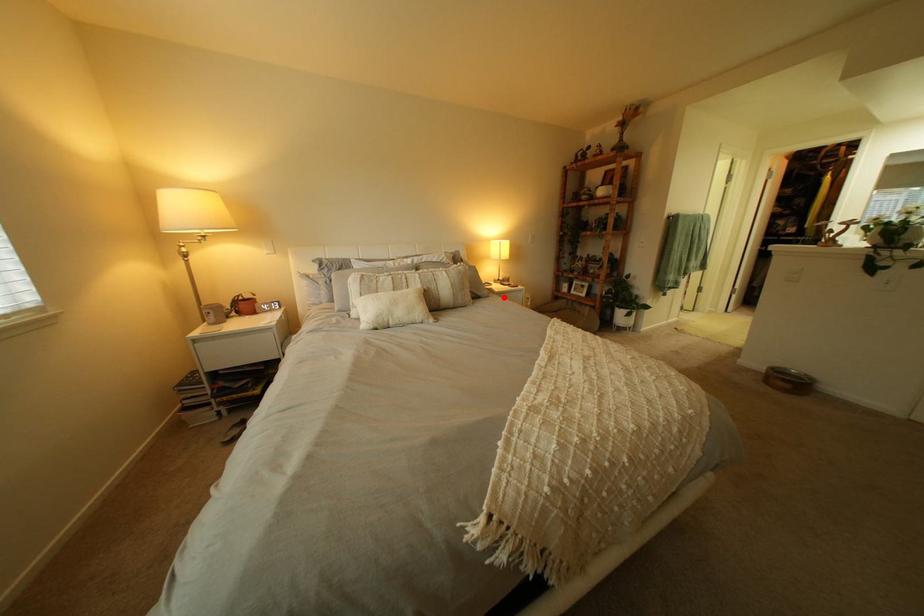
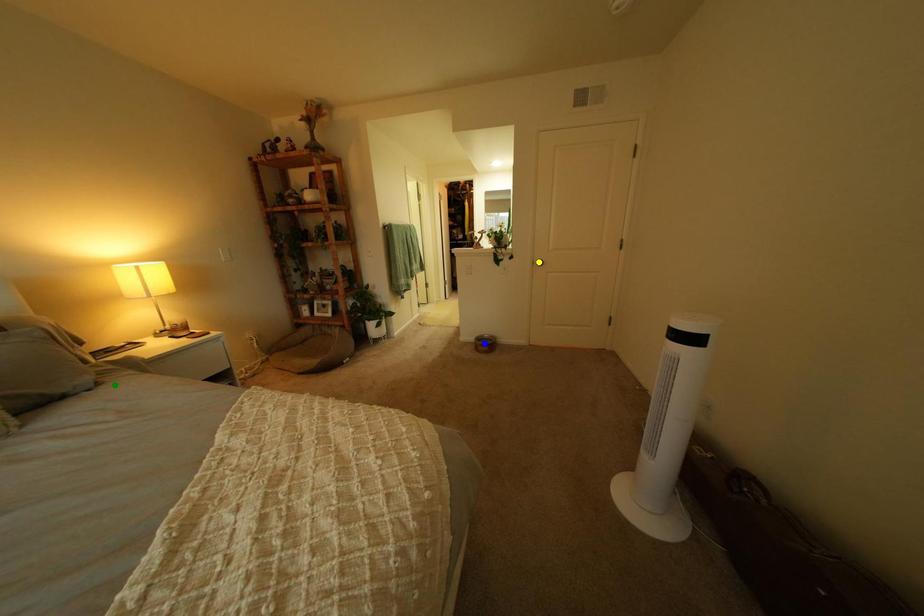
Question: I am providing you with two images of the same scene from different viewpoints. A red point is marked on the first image. You are given multiple points on the second image. In image 2, which mark is for the same physical point as the one in image 1?

Choices:
 (A) green point
 (B) yellow point
 (C) blue point

Answer: (A)